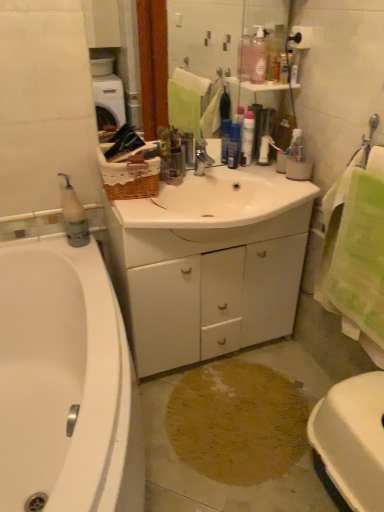
The image size is (384, 512). Find the location of `vacant space underneath brown textured rug at center (from a real-world perspective)`. vacant space underneath brown textured rug at center (from a real-world perspective) is located at coordinates (226, 432).